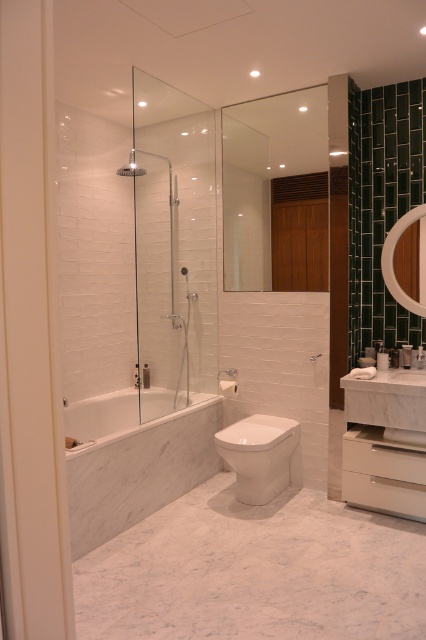
From the picture: Is white marble bathtub at center shorter than transparent glass shower door at center?

Indeed, white marble bathtub at center has a lesser height compared to transparent glass shower door at center.

Is white marble bathtub at center thinner than transparent glass shower door at center?

No.

Who is more distant from viewer, (x=72, y=545) or (x=149, y=202)?

The point (x=149, y=202) is behind.

The width and height of the screenshot is (426, 640). I want to click on white marble bathtub at center, so click(132, 461).

Consider the image. Can you confirm if white marble bathtub at lower left is shorter than matte brown mirror at upper right?

Correct, white marble bathtub at lower left is not as tall as matte brown mirror at upper right.

Describe the element at coordinates (123, 413) in the screenshot. I see `white marble bathtub at lower left` at that location.

Is point (164, 397) less distant than point (406, 300)?

No.

Where is `white marble bathtub at lower left`? This screenshot has height=640, width=426. white marble bathtub at lower left is located at coordinates (123, 413).

Between white marble bathtub at center and white marble sink at center, which one appears on the left side from the viewer's perspective?

white marble bathtub at center is more to the left.

Which is in front, point (104, 468) or point (411, 392)?

Positioned in front is point (104, 468).

Is point (114, 408) closer to camera compared to point (379, 355)?

No, it is behind (379, 355).

Find the location of a particular element. white marble bathtub at center is located at coordinates (132, 461).